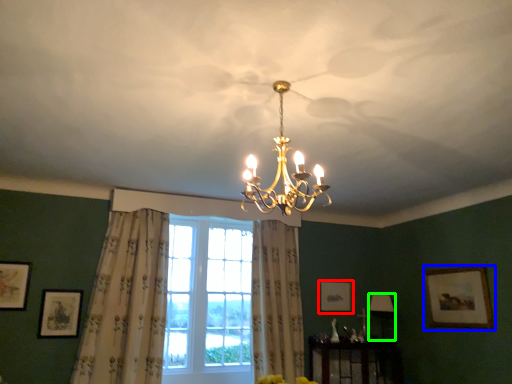
Question: Which object is the closest to the picture frame (highlighted by a red box)? Choose among these: picture frame (highlighted by a blue box) or lamp (highlighted by a green box).

Choices:
 (A) picture frame
 (B) lamp

Answer: (B)